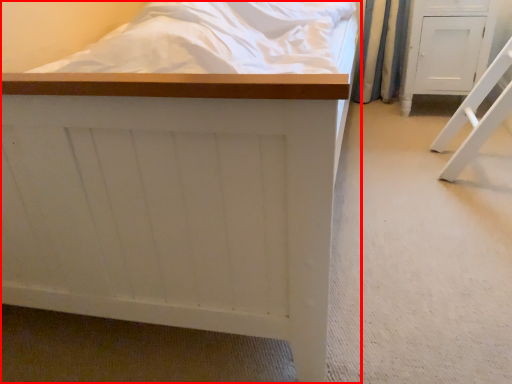
Question: From the image, what is the correct spatial relationship of furniture (annotated by the red box) in relation to furniture?

Choices:
 (A) right
 (B) left

Answer: (B)